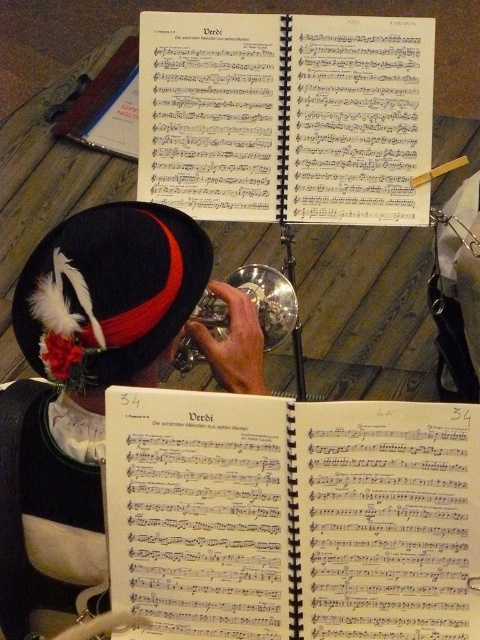
You are a photographer taking a picture of the musician and the music books. You notice two points marked in the scene. Which of the two points, point (59, 292) or point (94, 284), is closer to you?

Point (59, 292) is closer to you because it is further to the viewer than point (94, 284).

You are a conductor observing the scene. You notice the velvet hat at center and the velvet black hat with feather at upper left. Which hat is positioned lower in the image?

The velvet hat at center is located below the velvet black hat with feather at upper left, so the velvet hat at center is positioned lower in the image.

You are a photographer trying to capture a clear shot of the silver metallic trumpet at center. However, the velvet hat at center is blocking your view. Based on their widths, can you determine if the trumpet can be fully seen if you move slightly to the right?

The velvet hat at center might be wider than silver metallic trumpet at center, so moving to the right might not fully reveal the trumpet since the hat could still block part of it due to its potential greater width.